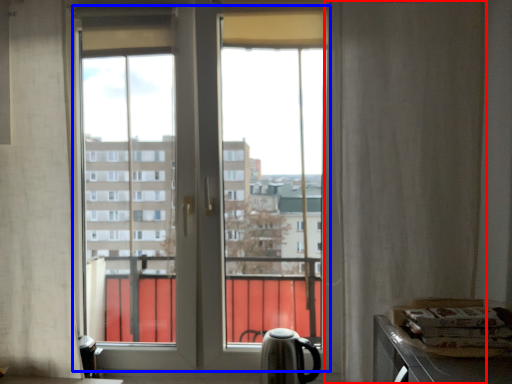
Question: Which point is further to the camera, curtain (highlighted by a red box) or bay window (highlighted by a blue box)?

Choices:
 (A) curtain
 (B) bay window

Answer: (B)